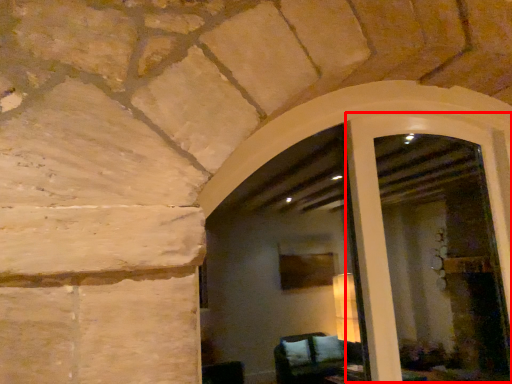
Question: From the image's perspective, what is the correct spatial relationship of screen door (annotated by the red box) in relation to window frame?

Choices:
 (A) above
 (B) below

Answer: (A)